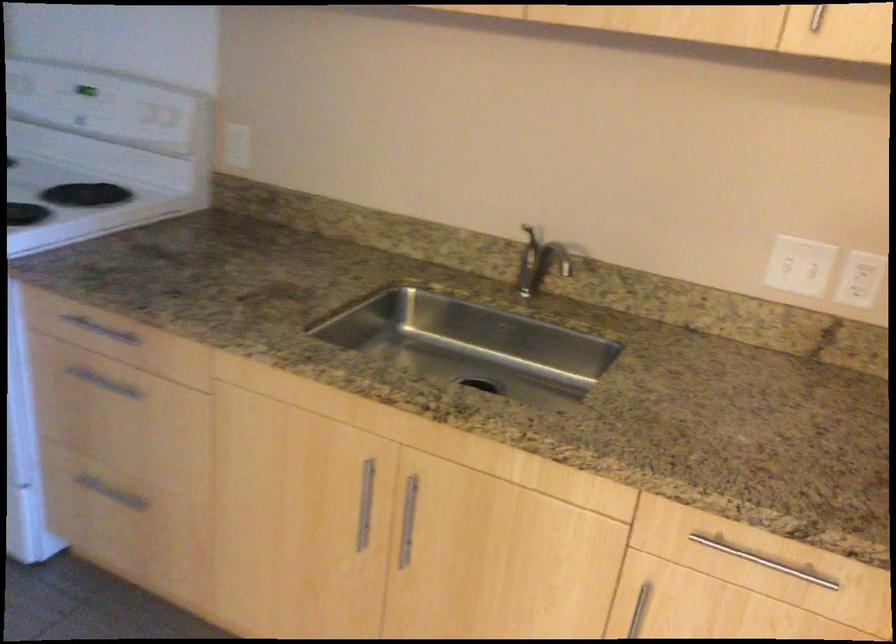
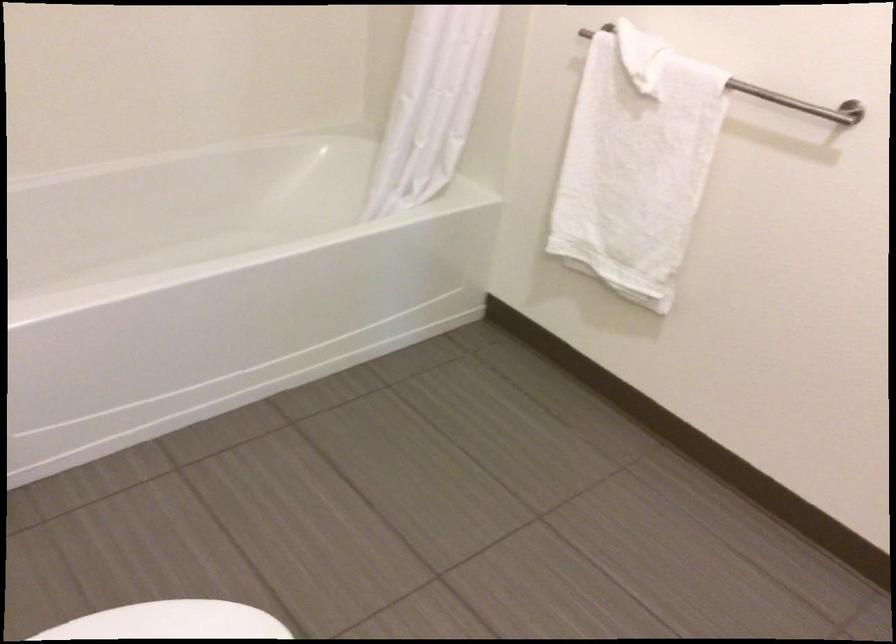
In a continuous first-person perspective shot, in which direction is the camera moving?

The movement direction of the cameraman is left, backward.